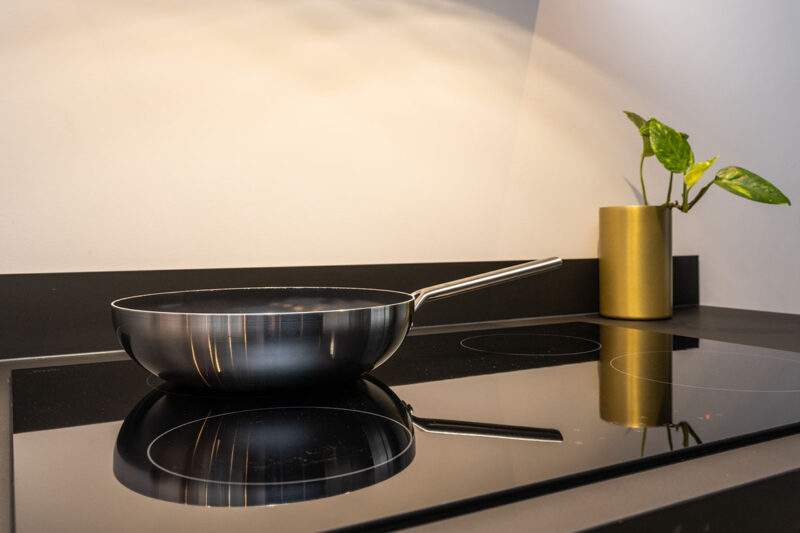
This screenshot has width=800, height=533. In order to click on stovetop, black and very shiny in this screenshot , I will do `click(434, 457)`.